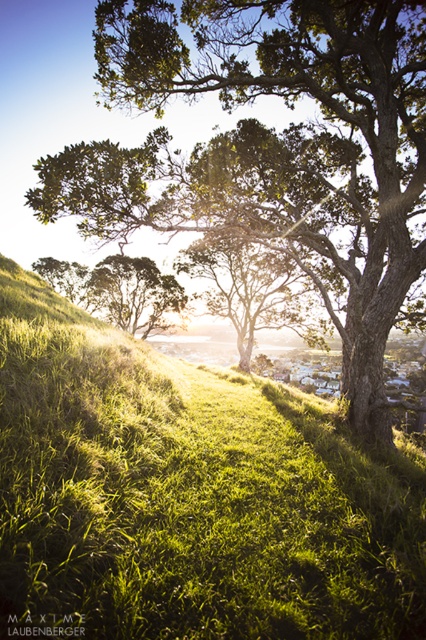
Question: Is green grassy hillside at center above green leafy tree at center?

Choices:
 (A) no
 (B) yes

Answer: (A)

Question: Which is nearer to the green leafy tree at center?

Choices:
 (A) green grassy hillside at center
 (B) green matte tree at center

Answer: (A)

Question: Considering the real-world distances, which object is farthest from the green leafy tree at center?

Choices:
 (A) green grassy hillside at center
 (B) green matte tree at center

Answer: (B)

Question: Is green leafy tree at center positioned before green matte tree at center?

Choices:
 (A) yes
 (B) no

Answer: (A)

Question: Among these points, which one is farthest from the camera?

Choices:
 (A) (100, 285)
 (B) (250, 6)
 (C) (37, 339)

Answer: (A)

Question: Is green leafy tree at center wider than green matte tree at center?

Choices:
 (A) no
 (B) yes

Answer: (B)